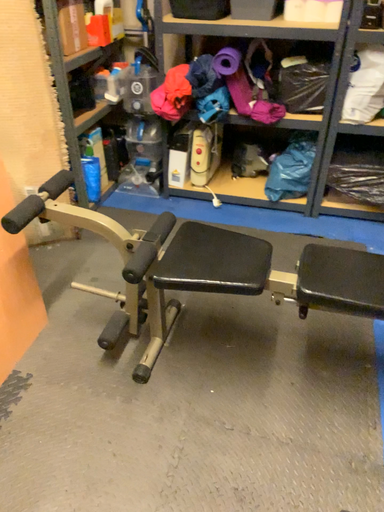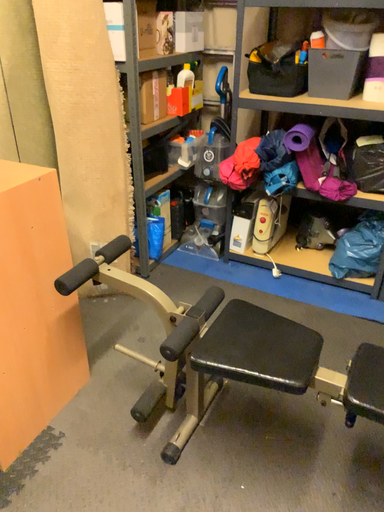
Question: Which way did the camera rotate in the video?

Choices:
 (A) rotated right
 (B) rotated left

Answer: (B)